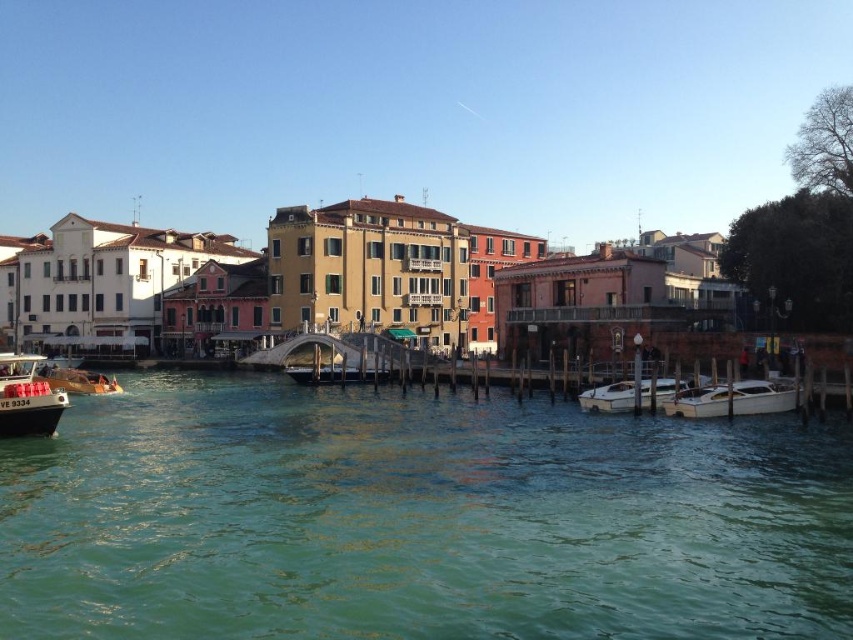
Question: Does green water at lower center have a larger size compared to shiny silver boat at center?

Choices:
 (A) yes
 (B) no

Answer: (A)

Question: Is matte black boat at lower left closer to camera compared to white glossy boat at lower right?

Choices:
 (A) yes
 (B) no

Answer: (A)

Question: Which point is farther from the camera taking this photo?

Choices:
 (A) (140, 465)
 (B) (744, 403)

Answer: (B)

Question: Which point appears closest to the camera in this image?

Choices:
 (A) (315, 371)
 (B) (714, 593)

Answer: (B)

Question: Is green water at lower center in front of white glossy boat at lower center?

Choices:
 (A) no
 (B) yes

Answer: (B)

Question: Based on their relative distances, which object is farther from the white glossy boat at lower center?

Choices:
 (A) matte black boat at lower left
 (B) green water at lower center
 (C) metallic gold boat at lower left
 (D) white glossy boat at lower right

Answer: (C)